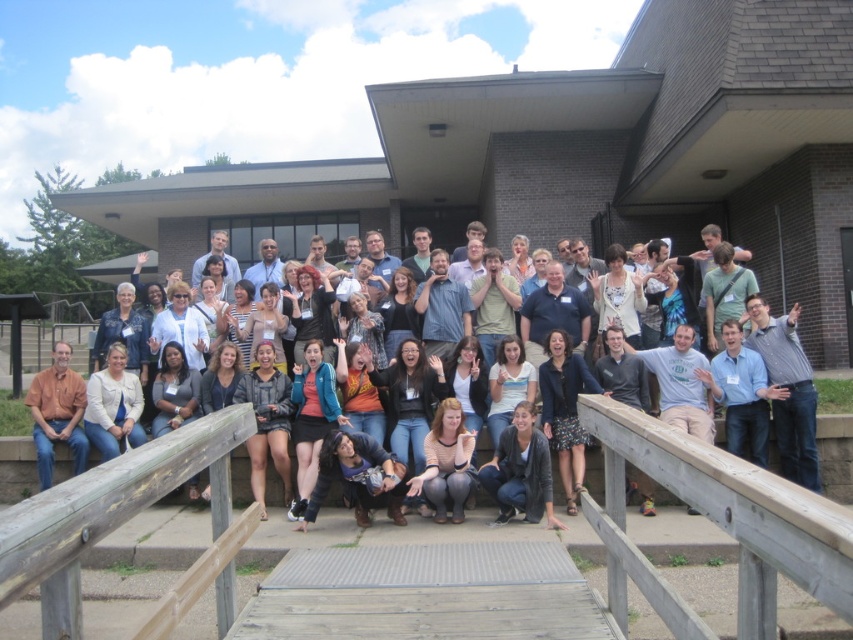
You are standing at the front of the group photo setup. You need to place a small decoration exactly halfway between the brown wooden rail at lower center and the matte black jacket at center. Which object will the decoration be closer to?

The decoration will be closer to the matte black jacket at center because the brown wooden rail at lower center is closer to the viewer than the matte black jacket at center, so the midpoint between them would be nearer to the jacket.

You are a photographer trying to frame a group photo. You have to decide whether to include both the brown wooden rail at lower center and the matte black jacket at center in the shot. Based on their widths, can you fit both in the same horizontal plane without one overlapping the other?

The brown wooden rail at lower center might be wider than matte black jacket at center, so there is a possibility that they could overlap if placed in the same horizontal plane. To avoid overlap, adjust the camera angle or position the subjects slightly to ensure both fit without overlapping.

You are standing on the wooden platform and want to move from point [682,449] to point [33,380]. Is the path between them clear of any obstacles?

The path between point [682,449] and point [33,380] is clear of any obstacles as the scene describes a large group of people gathered on the wooden platform but does not mention any physical barriers between these points.